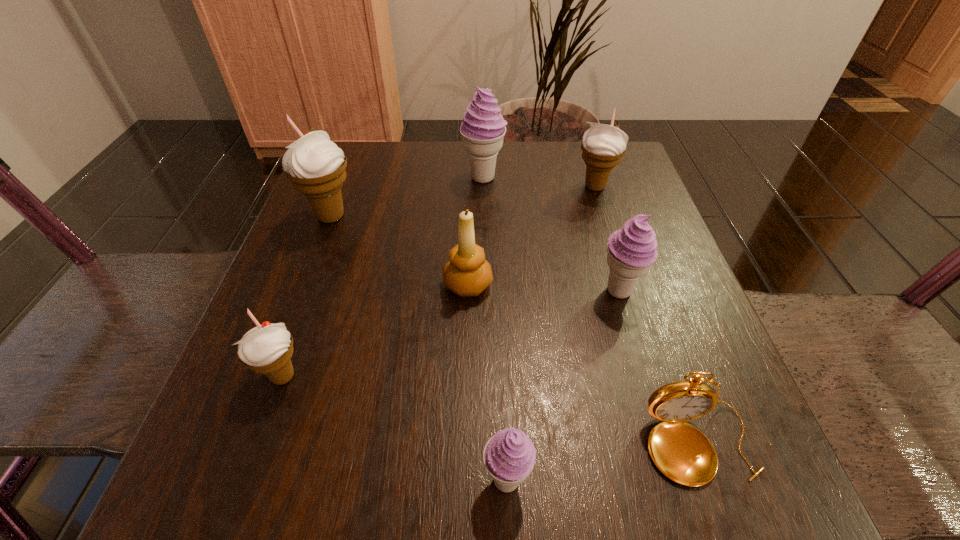
Identify the location of blank space at the far right corner of the desktop. (571, 190).

Find the location of a particular element. free space between the second biggest purple icecream and the pocket watch is located at coordinates (659, 368).

Find the location of a particular element. The height and width of the screenshot is (540, 960). blank region between the pocket watch and the sixth nearest object is located at coordinates (515, 330).

At what (x,y) coordinates should I click in order to perform the action: click on empty space that is in between the nearest icecream and the third nearest object. Please return your answer as a coordinate pair (x, y). Looking at the image, I should click on (395, 428).

Image resolution: width=960 pixels, height=540 pixels. Identify the location of empty location between the farthest purple icecream and the pocket watch. (591, 310).

Locate an element on the screen. The image size is (960, 540). empty space that is in between the farthest purple icecream and the second biggest white icecream is located at coordinates (540, 182).

The image size is (960, 540). I want to click on free point between the second biggest white icecream and the nearest icecream, so click(551, 334).

Find the location of `vacant area that lies between the second nearest purple icecream and the third nearest object`. vacant area that lies between the second nearest purple icecream and the third nearest object is located at coordinates (451, 334).

The image size is (960, 540). I want to click on unoccupied position between the candle_holder and the second biggest purple icecream, so click(543, 288).

Locate an element on the screen. empty location between the farthest purple icecream and the candle_holder is located at coordinates coord(475,231).